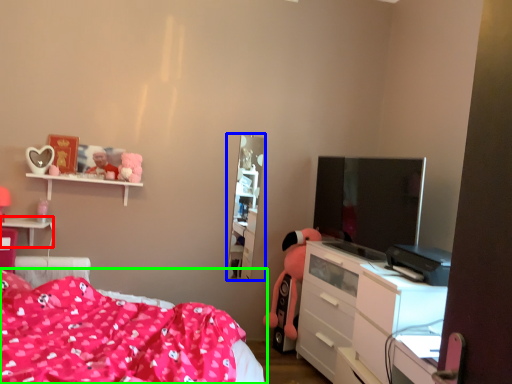
Question: Considering the real-world distances, which object is farthest from table (highlighted by a red box)? tv cabinet (highlighted by a blue box) or bed (highlighted by a green box)?

Choices:
 (A) tv cabinet
 (B) bed

Answer: (A)